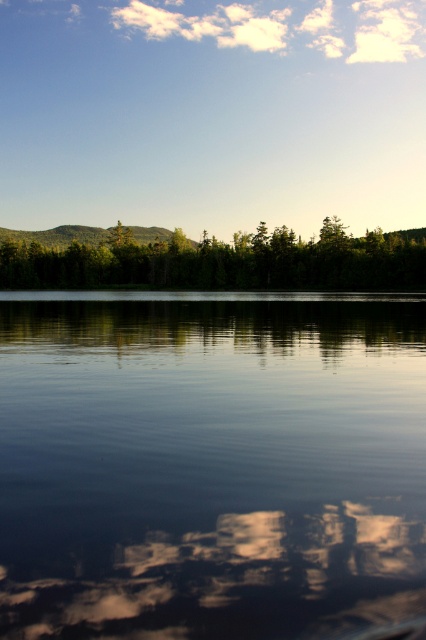
Question: Can you confirm if transparent water at center is smaller than green leafy trees at center?

Choices:
 (A) yes
 (B) no

Answer: (A)

Question: Is transparent water at center behind green leafy trees at center?

Choices:
 (A) no
 (B) yes

Answer: (A)

Question: Can you confirm if transparent water at center is positioned below green leafy trees at center?

Choices:
 (A) yes
 (B) no

Answer: (A)

Question: Which object appears closest to the camera in this image?

Choices:
 (A) transparent water at center
 (B) green leafy trees at center

Answer: (A)

Question: Which point is farther to the camera?

Choices:
 (A) green leafy trees at center
 (B) transparent water at center

Answer: (A)